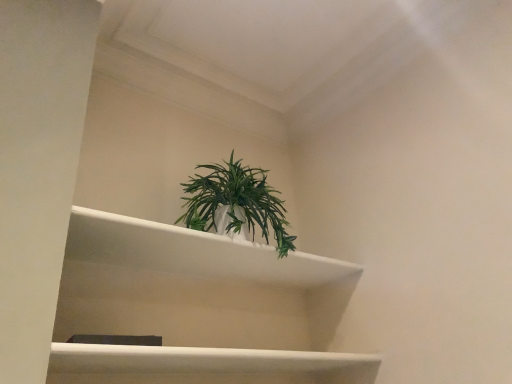
I want to click on green matte plant at center, so click(236, 202).

What do you see at coordinates (236, 202) in the screenshot? The width and height of the screenshot is (512, 384). I see `green matte plant at center` at bounding box center [236, 202].

This screenshot has height=384, width=512. What are the coordinates of `white glossy shelf at center` in the screenshot? It's located at (198, 308).

In order to face white glossy shelf at center, should I rotate leftwards or rightwards?

To align with it, rotate left about 4.064°.

What do you see at coordinates (198, 308) in the screenshot? I see `white glossy shelf at center` at bounding box center [198, 308].

This screenshot has width=512, height=384. What are the coordinates of `green matte plant at center` in the screenshot? It's located at (236, 202).

Is green matte plant at center at the left side of white glossy shelf at center?

Incorrect, green matte plant at center is not on the left side of white glossy shelf at center.

Which is behind, green matte plant at center or white glossy shelf at center?

green matte plant at center is further away from the camera.

Is point (187, 185) closer or farther from the camera than point (237, 338)?

Clearly, point (187, 185) is closer to the camera than point (237, 338).

From the image's perspective, is green matte plant at center on white glossy shelf at center?

Yes, from the image's perspective, green matte plant at center is above white glossy shelf at center.

From a real-world perspective, is green matte plant at center positioned above or below white glossy shelf at center?

Clearly, from a real-world perspective, green matte plant at center is above white glossy shelf at center.

Is green matte plant at center thinner than white glossy shelf at center?

Yes.

Is green matte plant at center shorter than white glossy shelf at center?

Correct, green matte plant at center is not as tall as white glossy shelf at center.

Does green matte plant at center have a smaller size compared to white glossy shelf at center?

Yes, green matte plant at center is smaller than white glossy shelf at center.

Would you say green matte plant at center is outside white glossy shelf at center?

Yes, green matte plant at center is located beyond the bounds of white glossy shelf at center.

Is green matte plant at center in contact with white glossy shelf at center?

No, green matte plant at center is not touching white glossy shelf at center.

Does green matte plant at center turn towards white glossy shelf at center?

No, green matte plant at center is not turned towards white glossy shelf at center.

Identify the location of houseplant that is on the right side of white glossy shelf at center. (236, 202).

Considering the positions of objects white glossy shelf at center and green matte plant at center in the image provided, who is more to the left, white glossy shelf at center or green matte plant at center?

white glossy shelf at center.

Considering the relative positions of white glossy shelf at center and green matte plant at center in the image provided, is white glossy shelf at center in front of green matte plant at center?

Yes, white glossy shelf at center is in front of green matte plant at center.

Is point (80, 249) positioned after point (184, 184)?

No.

From the image's perspective, is white glossy shelf at center positioned above or below green matte plant at center?

white glossy shelf at center is situated lower than green matte plant at center in the image.

From a real-world perspective, which is physically below, white glossy shelf at center or green matte plant at center?

In real-world perspective, white glossy shelf at center is lower.

Between white glossy shelf at center and green matte plant at center, which one has larger width?

Wider between the two is white glossy shelf at center.

Which of these two, white glossy shelf at center or green matte plant at center, stands shorter?

green matte plant at center.

Considering the relative sizes of white glossy shelf at center and green matte plant at center in the image provided, is white glossy shelf at center bigger than green matte plant at center?

Yes.

Choose the correct answer: Is white glossy shelf at center inside green matte plant at center or outside it?

white glossy shelf at center is located beyond the bounds of green matte plant at center.

Are white glossy shelf at center and green matte plant at center far apart?

No, there isn't a large distance between white glossy shelf at center and green matte plant at center.

Is white glossy shelf at center facing towards green matte plant at center?

No.

In the scene shown: Can you tell me how much white glossy shelf at center and green matte plant at center differ in facing direction?

1.41 degrees.

How much distance is there between white glossy shelf at center and green matte plant at center?

The distance of white glossy shelf at center from green matte plant at center is 10.41 inches.

Where is `houseplant behind the white glossy shelf at center`? The image size is (512, 384). houseplant behind the white glossy shelf at center is located at coordinates (236, 202).

Image resolution: width=512 pixels, height=384 pixels. In order to click on houseplant on the right of white glossy shelf at center in this screenshot , I will do `click(236, 202)`.

At what (x,y) coordinates should I click in order to perform the action: click on shelf directly beneath the green matte plant at center (from a real-world perspective). Please return your answer as a coordinate pair (x, y). The height and width of the screenshot is (384, 512). Looking at the image, I should click on (198, 308).